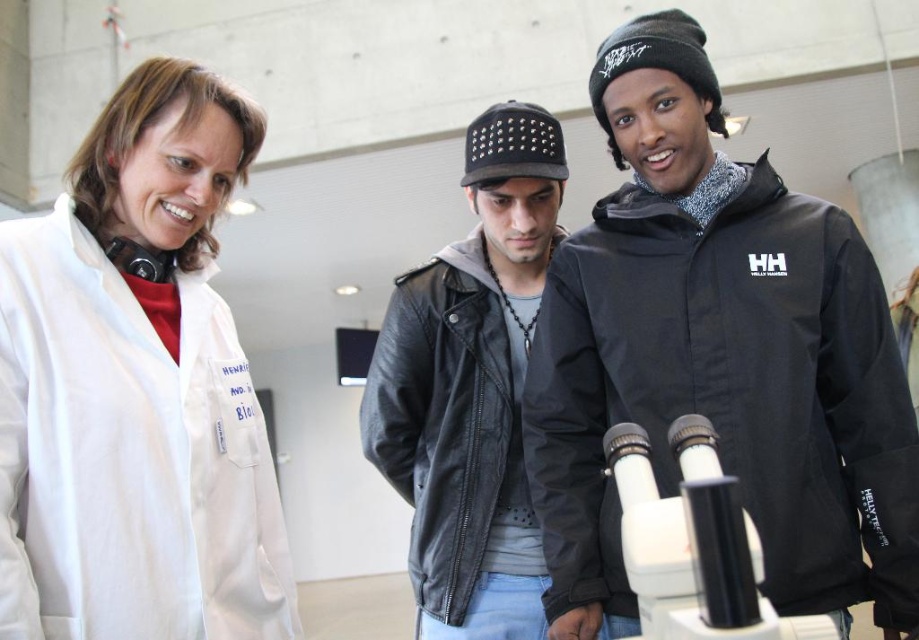
You are a visitor in the facility and want to take a photo of the white plastic microscope at center without blocking it with the white lab coat at upper left. Is there a way to do this?

The white lab coat at upper left is positioned over the white plastic microscope at center, so you would need to move the lab coat or adjust your angle to avoid blocking the microscope.